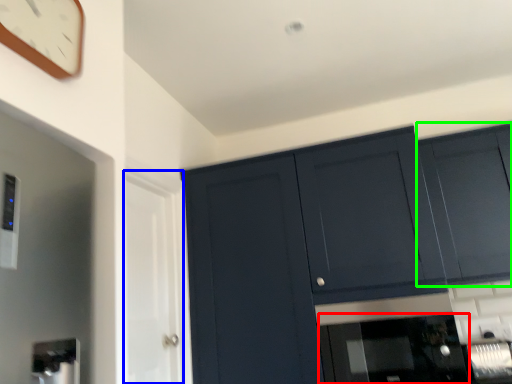
Question: Which object is the farthest from appliance (highlighted by a red box)? Choose among these: glass door (highlighted by a blue box) or cabinetry (highlighted by a green box).

Choices:
 (A) glass door
 (B) cabinetry

Answer: (A)